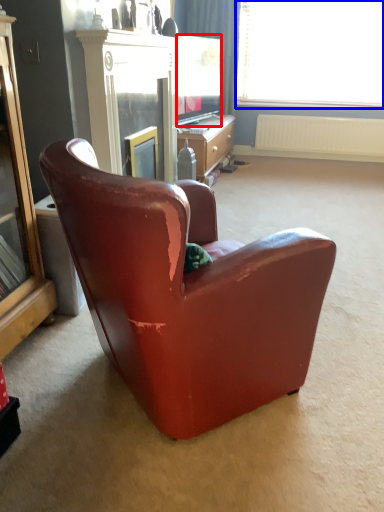
Question: Which object is further to the camera taking this photo, television (highlighted by a red box) or window (highlighted by a blue box)?

Choices:
 (A) television
 (B) window

Answer: (B)